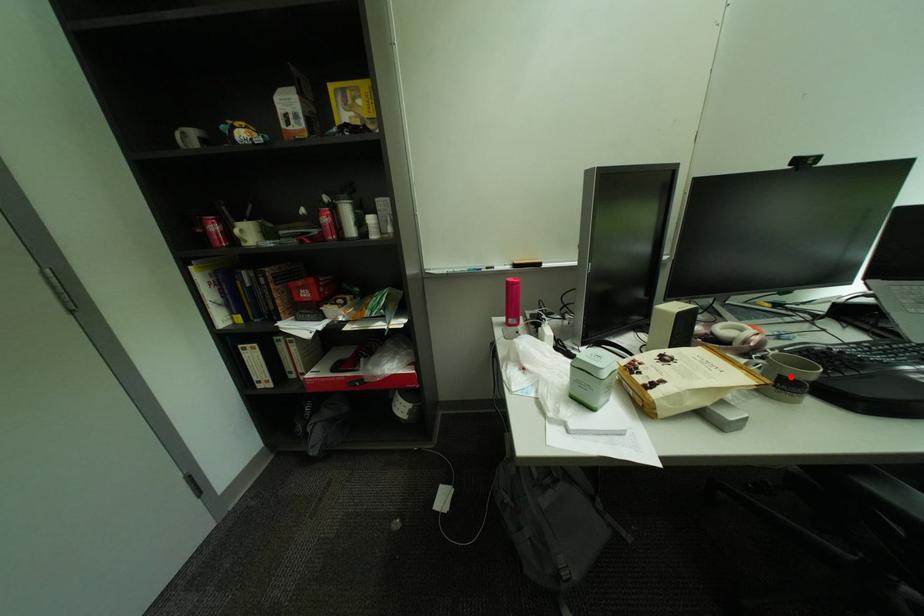
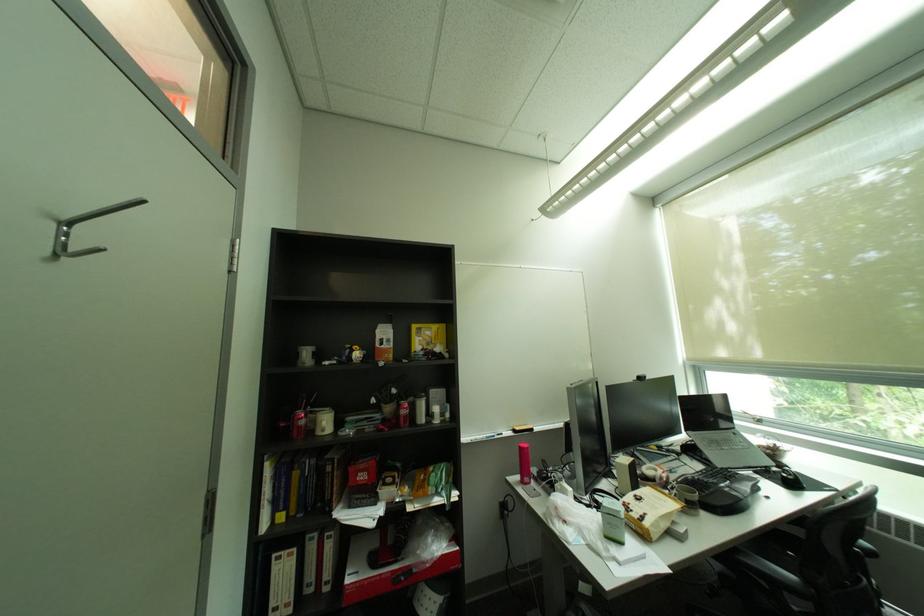
The point at the highlighted location is marked in the first image. Where is the corresponding point in the second image?

(697, 500)